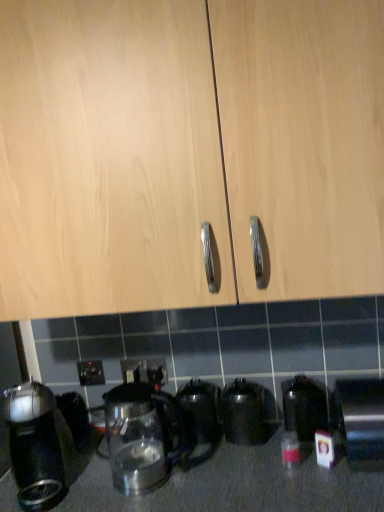
Find the location of a particular element. This screenshot has height=512, width=384. vacant region above satin silver toaster at lower right, which ranks as the 1th kitchen appliance in right-to-left order (from a real-world perspective) is located at coordinates (362, 386).